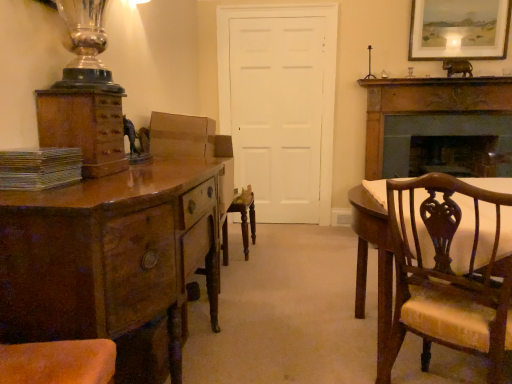
Find the location of `free space above white matte door at center (from a real-world perspective)`. free space above white matte door at center (from a real-world perspective) is located at coordinates (277, 21).